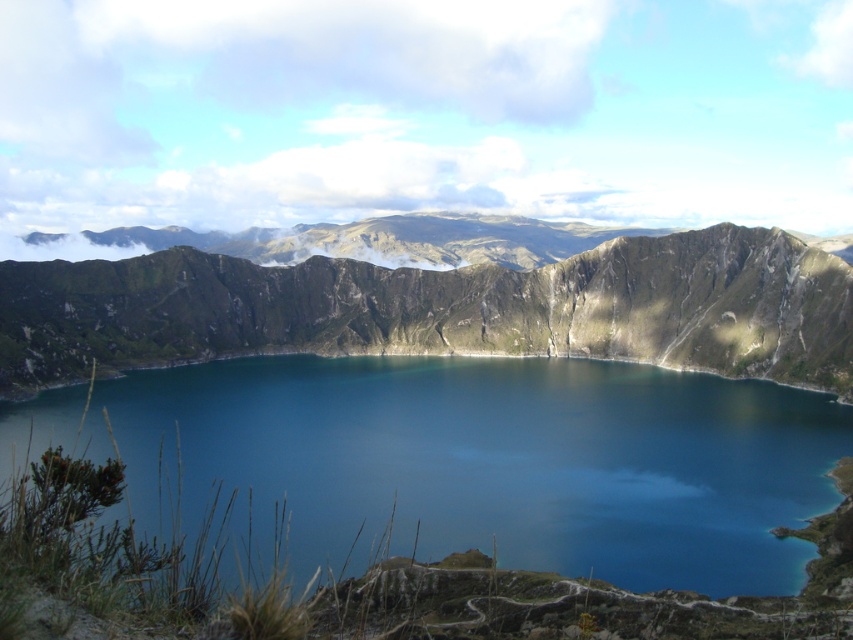
Question: Is blue glassy water at center smaller than rugged stone mountain at center?

Choices:
 (A) no
 (B) yes

Answer: (B)

Question: Which point is farther from the camera taking this photo?

Choices:
 (A) (529, 390)
 (B) (422, 291)

Answer: (B)

Question: Does blue glassy water at center appear on the right side of rugged stone mountain at center?

Choices:
 (A) yes
 (B) no

Answer: (B)

Question: In this image, where is blue glassy water at center located relative to rugged stone mountain at center?

Choices:
 (A) below
 (B) above

Answer: (A)